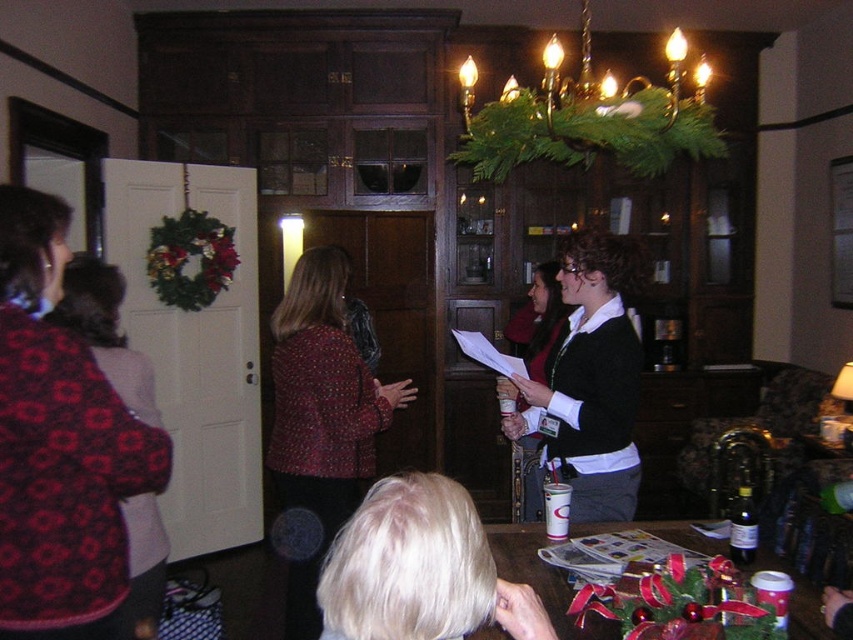
Does red textured blazer at center have a larger size compared to matte black sweater at center?

No.

Who is taller, red textured blazer at center or matte black sweater at center?

Standing taller between the two is red textured blazer at center.

Between point (341, 499) and point (509, 328), which one is positioned in front?

Point (341, 499) is in front.

I want to click on red textured blazer at center, so click(x=321, y=416).

Can you confirm if red textured blazer at center is positioned below red patterned sweater at left?

Correct, red textured blazer at center is located below red patterned sweater at left.

Which is in front, point (341, 460) or point (131, 358)?

Point (131, 358) is in front.

I want to click on red textured blazer at center, so click(x=321, y=416).

Looking at this image, does red patterned sweater at left have a lesser height compared to matte black sweater at center?

Indeed, red patterned sweater at left has a lesser height compared to matte black sweater at center.

Does red patterned sweater at left have a larger size compared to matte black sweater at center?

No, red patterned sweater at left is not bigger than matte black sweater at center.

At what (x,y) coordinates should I click in order to perform the action: click on red patterned sweater at left. Please return your answer as a coordinate pair (x, y). Looking at the image, I should click on (106, 332).

This screenshot has height=640, width=853. Find the location of `red patterned sweater at left`. red patterned sweater at left is located at coordinates (106, 332).